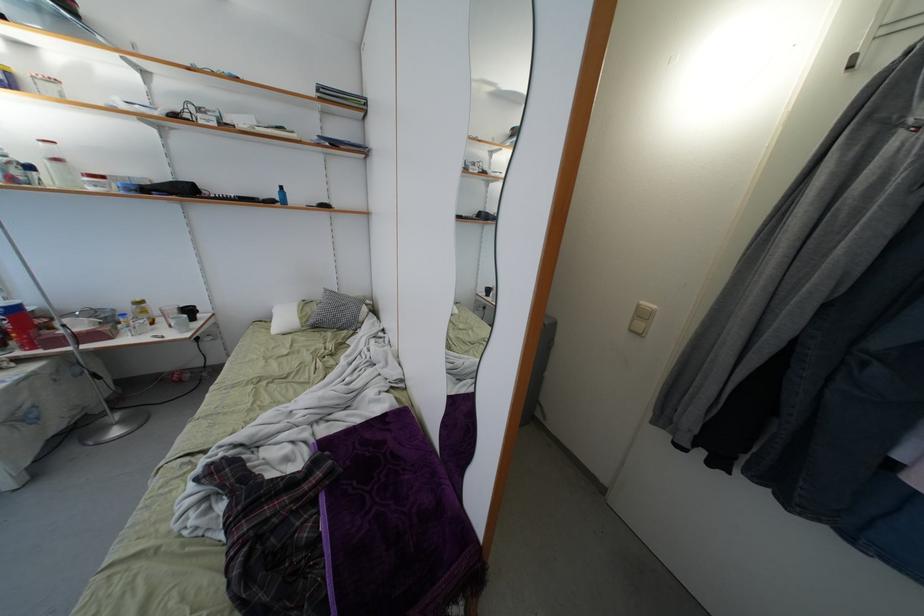
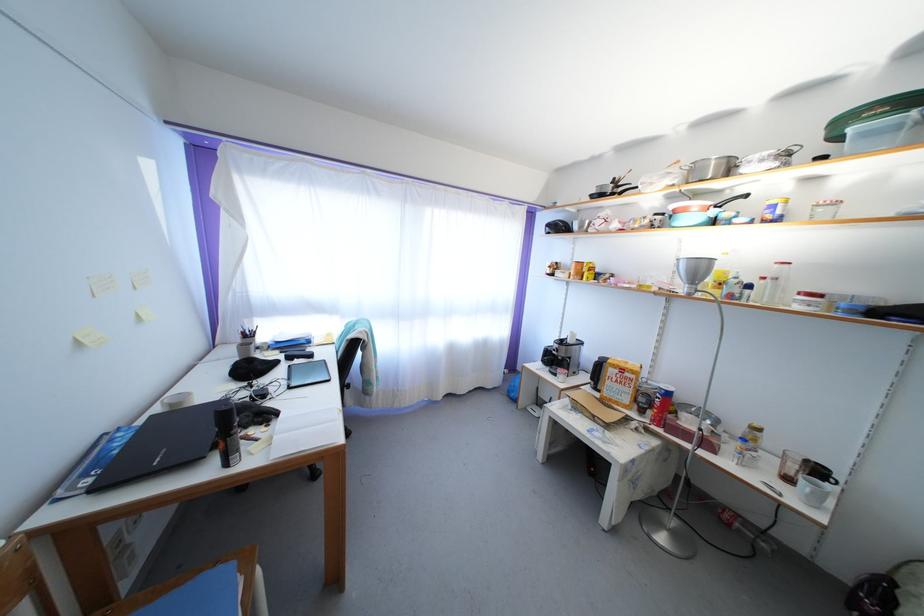
Question: How did the camera likely rotate?

Choices:
 (A) Left
 (B) Right
 (C) Up
 (D) Down

Answer: (A)